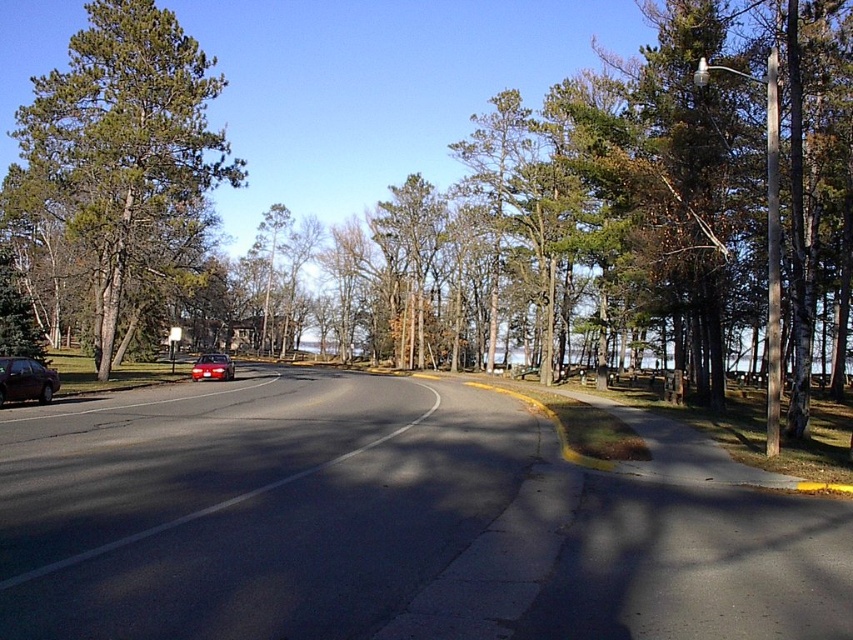
You are driving a car and see the green matte tree at left and the shiny dark brown sedan at left in your side mirror. Which object is closer to the road?

The green matte tree at left is positioned on the left side of the shiny dark brown sedan at left, so the shiny dark brown sedan at left is closer to the road.

You are standing at the point marked as point (25, 380) in the image. What object is exactly at that location?

The shiny dark brown sedan at left is exactly at point (25, 380).